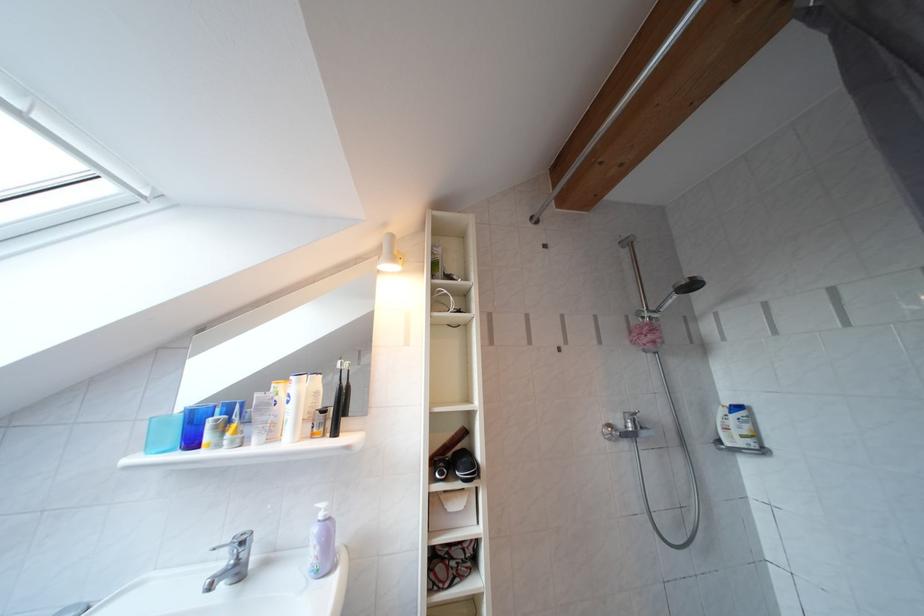
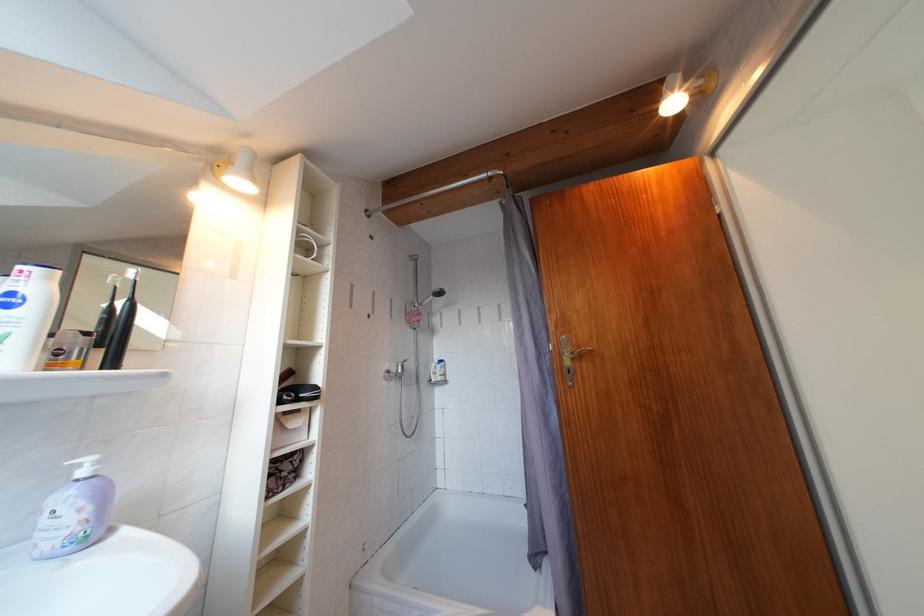
The point at (618, 431) is marked in the first image. Where is the corresponding point in the second image?

(396, 377)